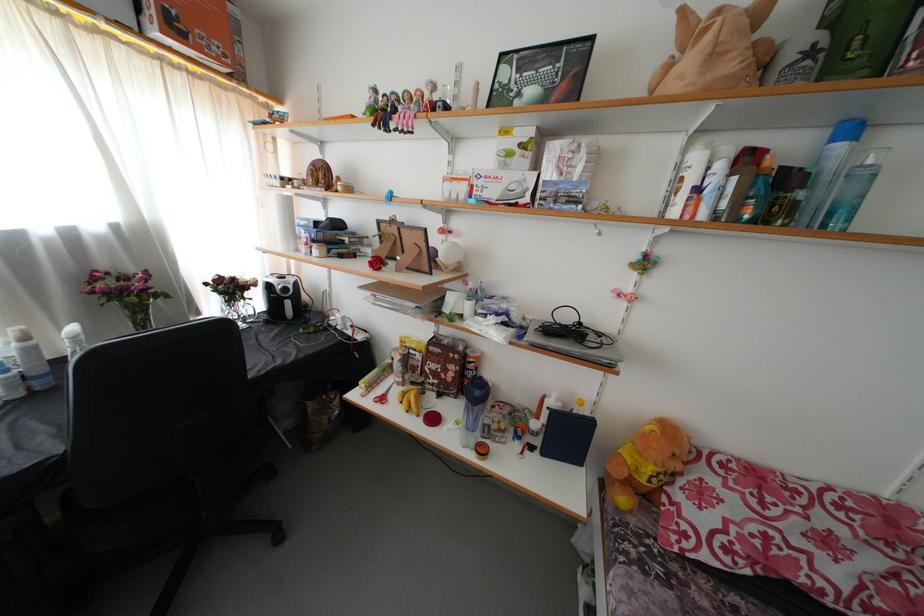
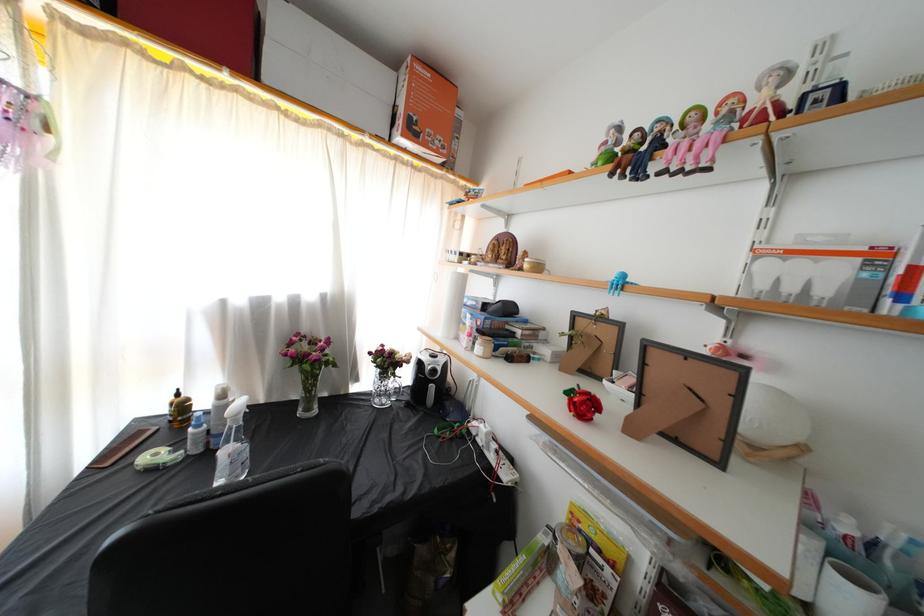
Locate, in the second image, the point that corresponds to (397,131) in the first image.

(659, 172)